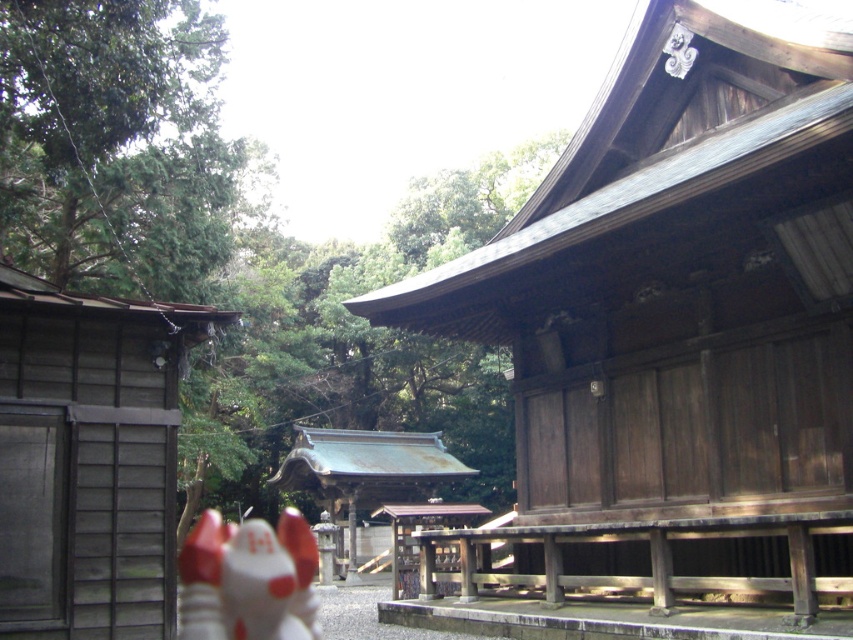
You are visiting a traditional Japanese shrine and want to take a photo of the brown wooden hut at center and the white glossy fox at lower left. Based on their positions, which object should you place on the right side of your camera frame?

The brown wooden hut at center should be placed on the right side of your camera frame since it is positioned on the right side of the white glossy fox at lower left.

You are a visitor at the shrine and want to take a photo of both the white glossy fox at lower left and the rusty metal shrine at center. Which object should you focus on to ensure both are in focus?

The white glossy fox at lower left is thinner than the rusty metal shrine at center. Since the fox is closer to the camera, you should focus on the shrine to ensure both are in focus.

You are a visitor at the shrine and want to take a photo of both the white glossy fox at lower left and the rusty metal shrine at center. Based on their positions, which object should you adjust your camera angle to include first in your shot?

The white glossy fox at lower left is to the left of the rusty metal shrine at center, so you should adjust your camera angle to include the white glossy fox at lower left first before framing the rusty metal shrine at center.